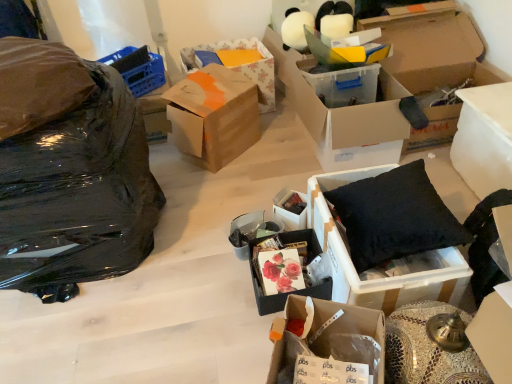
This screenshot has width=512, height=384. I want to click on free space in front of brown cardboard box at center, placed as the first box when sorted from left to right, so click(223, 188).